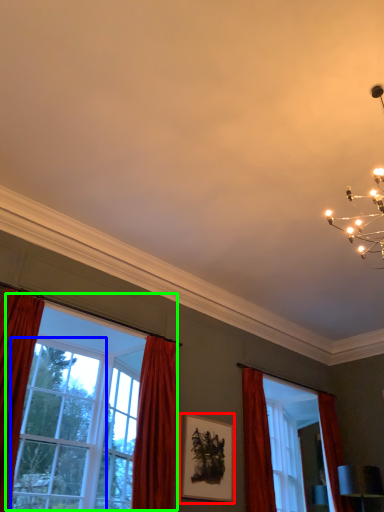
Question: Considering the real-world distances, which object is farthest from picture frame (highlighted by a red box)? window (highlighted by a blue box) or window (highlighted by a green box)?

Choices:
 (A) window
 (B) window

Answer: (A)